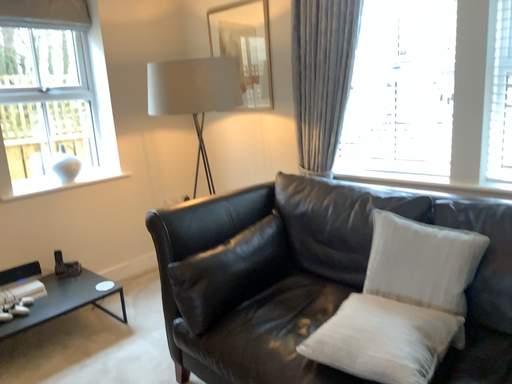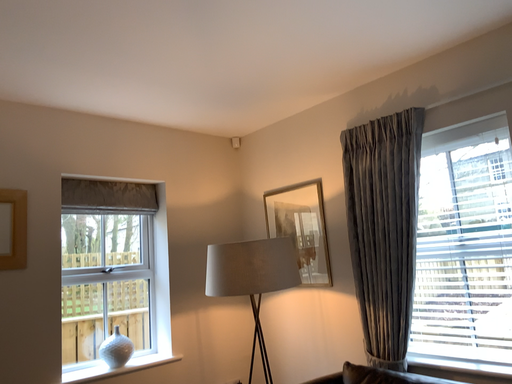
Question: How did the camera likely rotate when shooting the video?

Choices:
 (A) rotated upward
 (B) rotated downward

Answer: (A)